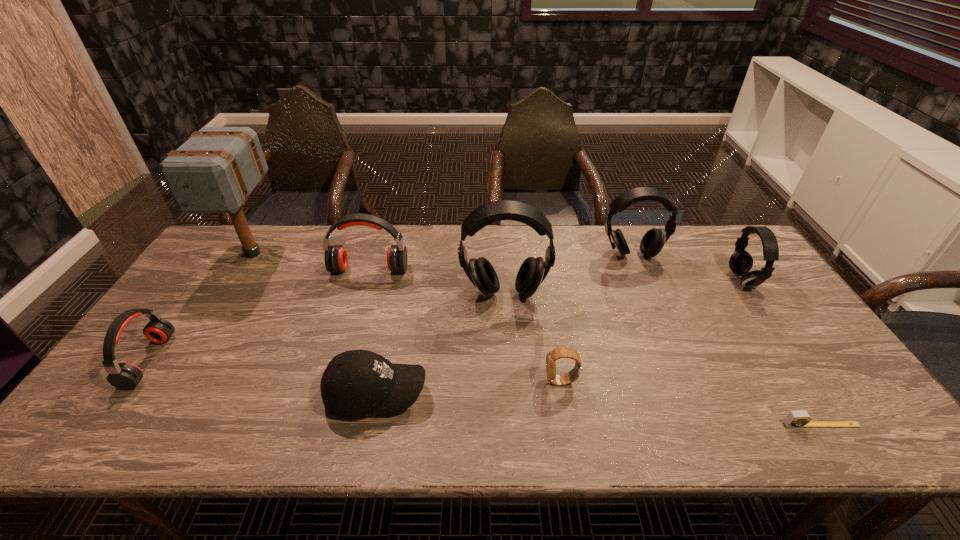
Locate an element on the screen. Image resolution: width=960 pixels, height=540 pixels. vacant space located 0.330m on the ear cups of the rightmost earphone is located at coordinates (623, 280).

The height and width of the screenshot is (540, 960). In order to click on free region located 0.210m on the ear cups of the rightmost earphone in this screenshot , I will do `click(662, 280)`.

This screenshot has width=960, height=540. What are the coordinates of `free space located on the ear cups of the nearest earphone` in the screenshot? It's located at click(x=255, y=361).

Locate an element on the screen. Image resolution: width=960 pixels, height=540 pixels. vacant region located 0.240m on the front-facing side of the baseball cap is located at coordinates (529, 394).

At what (x,y) coordinates should I click in order to perform the action: click on vacant space located on the face of the watch. Please return your answer as a coordinate pair (x, y). The height and width of the screenshot is (540, 960). Looking at the image, I should click on (386, 381).

Where is `vacant position located 0.160m on the face of the watch`? This screenshot has height=540, width=960. vacant position located 0.160m on the face of the watch is located at coordinates (480, 381).

Locate an element on the screen. The image size is (960, 540). free location located 0.280m on the face of the watch is located at coordinates [x=431, y=381].

Find the location of `mallet located at the far edge`. mallet located at the far edge is located at coordinates (215, 171).

The width and height of the screenshot is (960, 540). Find the location of `baseball cap present at the near edge`. baseball cap present at the near edge is located at coordinates (355, 383).

At what (x,y) coordinates should I click in order to perform the action: click on tape measure present at the near edge. Please return your answer as a coordinate pair (x, y). Looking at the image, I should click on (795, 419).